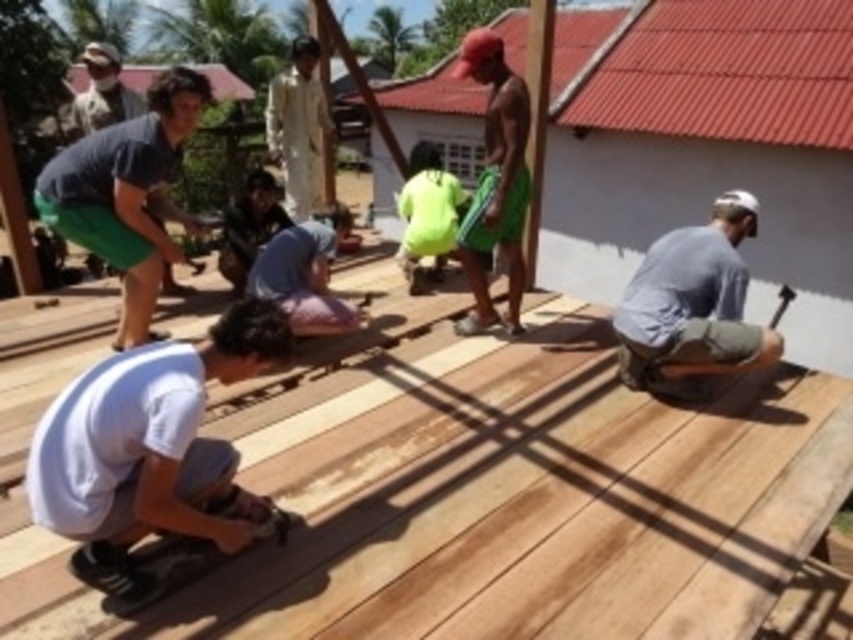
Does light brown wood at center appear on the right side of green fabric shorts at center?

Correct, you'll find light brown wood at center to the right of green fabric shorts at center.

Where is `light brown wood at center`? The image size is (853, 640). light brown wood at center is located at coordinates (486, 500).

Between white matte shirt at lower left and wooden beam at center, which one is positioned lower?

white matte shirt at lower left is lower down.

The image size is (853, 640). What are the coordinates of `white matte shirt at lower left` in the screenshot? It's located at (152, 452).

Find the location of a particular element. This screenshot has width=853, height=640. white matte shirt at lower left is located at coordinates (152, 452).

I want to click on gray fabric shirt at lower right, so click(x=692, y=305).

You are a GUI agent. You are given a task and a screenshot of the screen. Output one action in this format:
    pyautogui.click(x=<x>, y=<y>)
    Task: Click on the gray fabric shirt at lower right
    The image size is (853, 640).
    Given the screenshot: What is the action you would take?
    pyautogui.click(x=692, y=305)